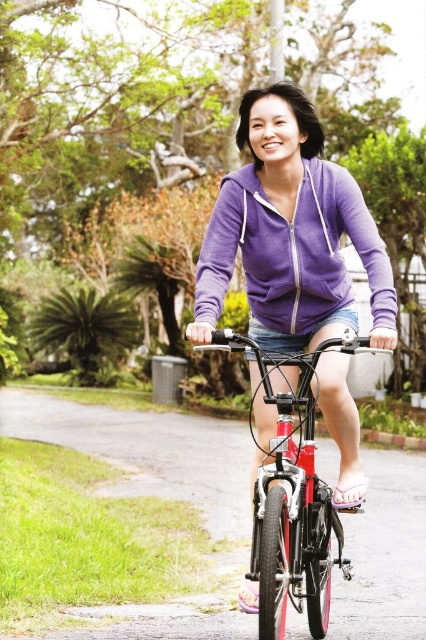
You are a photographer trying to capture a clear shot of the purple fleece sweatshirt at center and the shiny metallic bicycle at center. Since you want both subjects to be in focus, which one should you adjust your camera focus on first, considering their sizes?

The purple fleece sweatshirt at center occupies less space than the shiny metallic bicycle at center, so you should focus on the smaller purple fleece sweatshirt at center first to ensure both are in focus.

You are a delivery drone trying to deliver a package to the purple fleece sweatshirt at center. The delivery zone is a 0.2 meter radius around point (293, 250). Your current position is at point 0.5, 0.5. Can you land safely within the delivery zone?

The purple fleece sweatshirt at center is located at point (293, 250). The delivery zone has a 0.2 meter radius around this point. Your current position is at 0.5, 0.5. The distance between your current position and the delivery zone center is sqrt. Since the distance is less than 0.2 meters, you can land safely within the delivery zone.